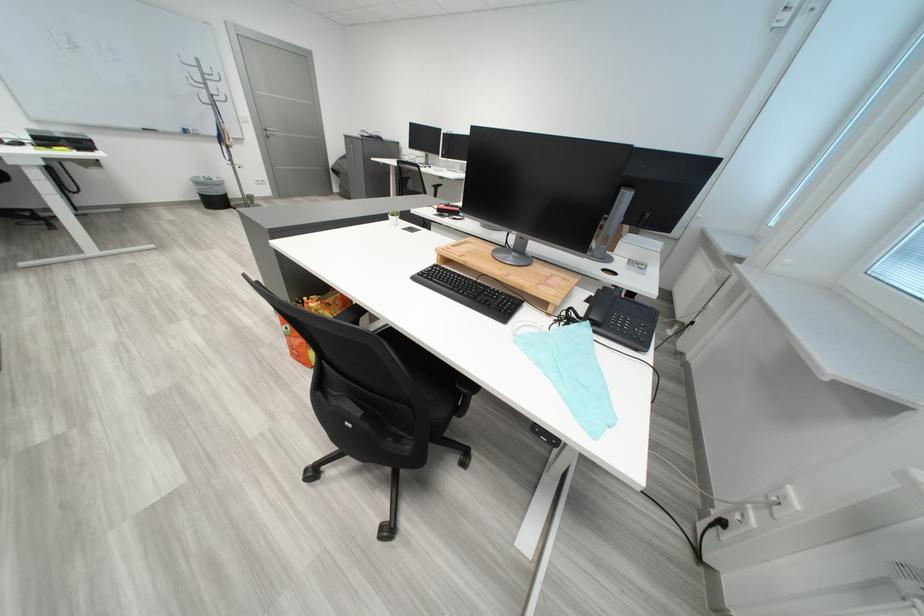
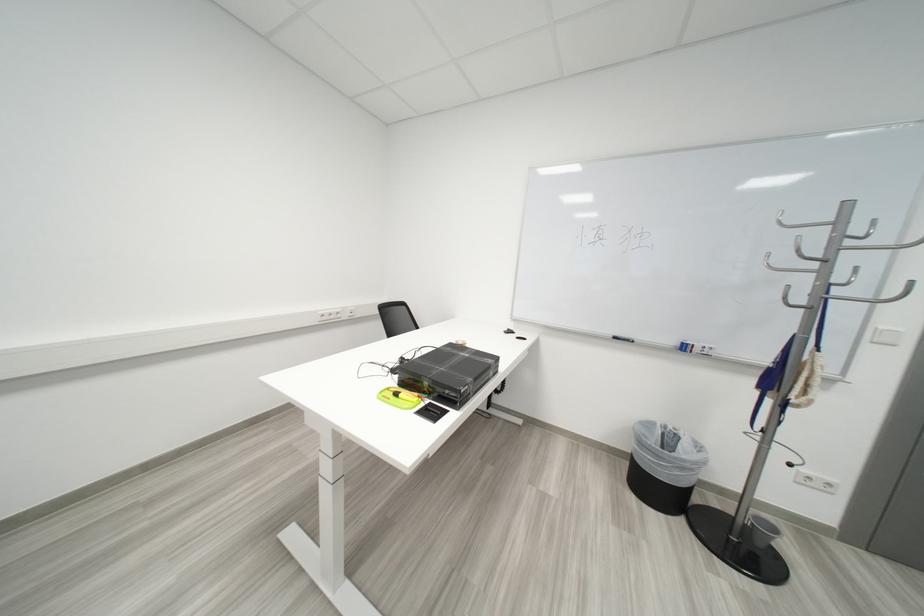
The point at (199, 132) is marked in the first image. Where is the corresponding point in the second image?

(698, 350)